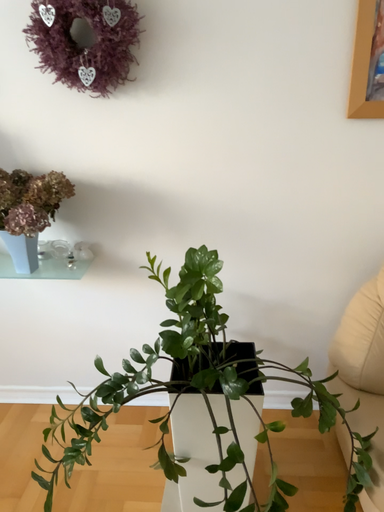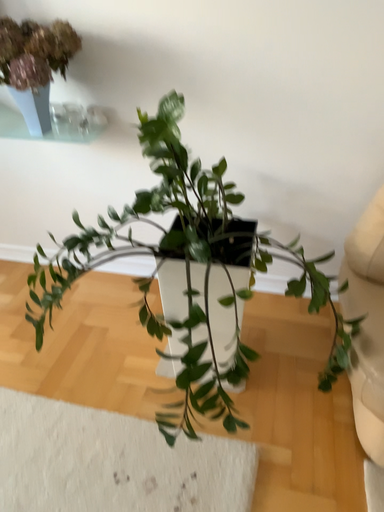
Question: How did the camera likely rotate when shooting the video?

Choices:
 (A) rotated left
 (B) rotated right

Answer: (A)